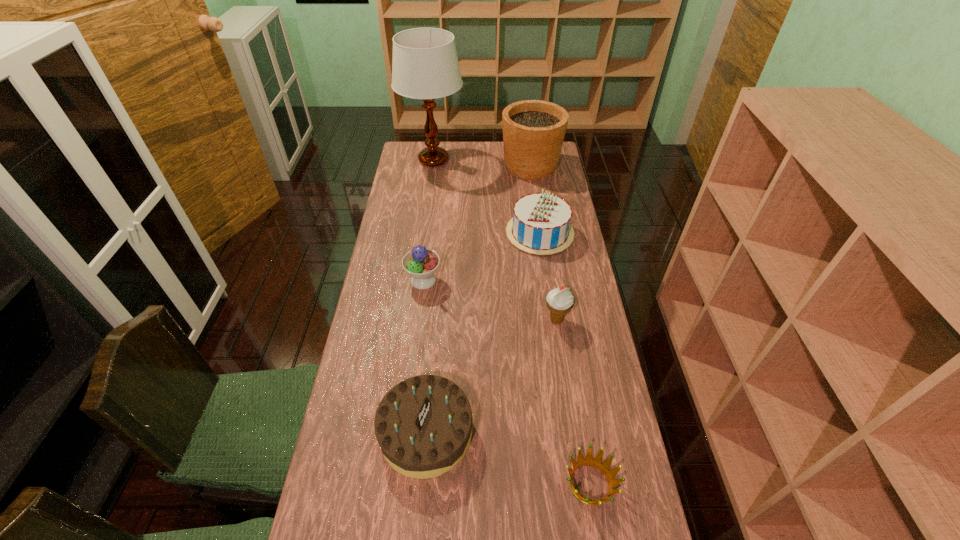
Identify which object is the sixth nearest to the fifth nearest object. Please provide its 2D coordinates. Your answer should be formatted as a tuple, i.e. [(x, y)], where the tuple contains the x and y coordinates of a point satisfying the conditions above.

[(596, 462)]

The height and width of the screenshot is (540, 960). I want to click on blank area in the image that satisfies the following two spatial constraints: 1. on the back side of the crown; 2. on the front-facing side of the nearer birthday cake, so click(582, 433).